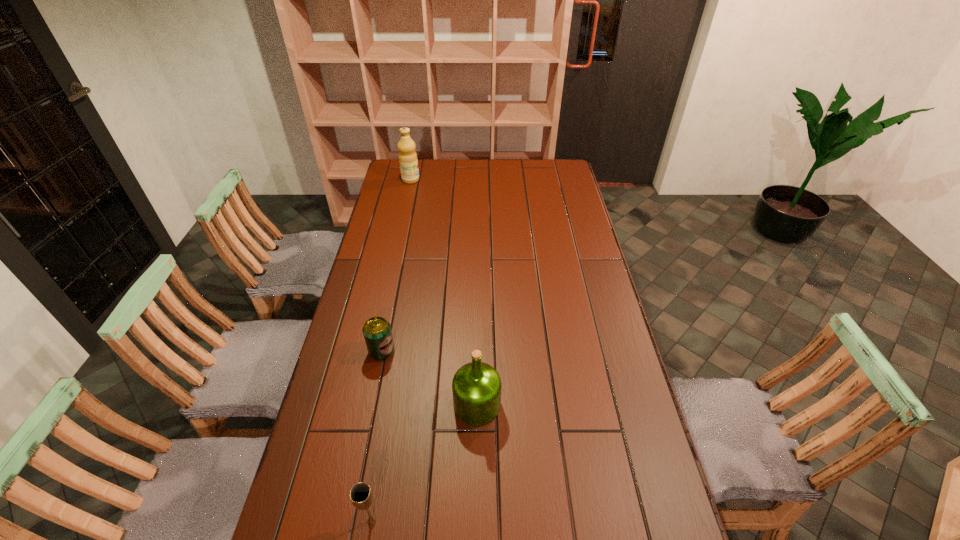
Identify the location of the left olive oil. The image size is (960, 540). (408, 162).

The image size is (960, 540). I want to click on the farther olive oil, so click(408, 162).

You are a GUI agent. You are given a task and a screenshot of the screen. Output one action in this format:
    pyautogui.click(x=<x>, y=<y>)
    Task: Click on the rightmost object
    
    Given the screenshot: What is the action you would take?
    pyautogui.click(x=476, y=387)

The width and height of the screenshot is (960, 540). Identify the location of the right olive oil. (476, 387).

I want to click on chalice, so click(x=361, y=495).

I want to click on the nearest object, so click(x=361, y=495).

The width and height of the screenshot is (960, 540). Identify the location of the shortest object. (377, 332).

Identify the location of beer can. This screenshot has width=960, height=540. (377, 332).

Identify the location of vacant space located on the label of the farthest object. The width and height of the screenshot is (960, 540). (490, 180).

The width and height of the screenshot is (960, 540). Find the location of `vacant space positioned on the back of the right olive oil`. vacant space positioned on the back of the right olive oil is located at coordinates 477,353.